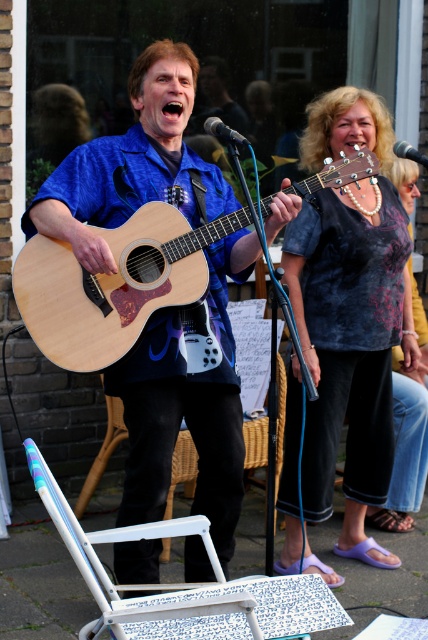
You are a photographer trying to capture the performer holding the matte wood guitar at center and the metallic silver microphone at upper center. Which object should you focus on first if you want to photograph them in order from closest to farthest from the camera?

The matte wood guitar at center is positioned under the metallic silver microphone at upper center, meaning the guitar is closer to the camera. Therefore, you should focus on the matte wood guitar at center first, followed by the metallic silver microphone at upper center.

You are a photographer standing in front of the performers. You want to take a photo that focuses on the matte wood guitar at center while keeping the metallic silver microphone at center in the background. Is the current arrangement suitable for this?

The matte wood guitar at center is closer to the viewer than the metallic silver microphone at center, so the current arrangement is suitable for focusing on the matte wood guitar at center while having the metallic silver microphone at center in the background.

Looking at this image, you are standing at the origin point of the coordinate system in the image. There are two points marked in the scene. Which point is closer to you, point (205, 400) or point (403, 140)?

Point (205, 400) is closer to you because it is in front of point (403, 140).